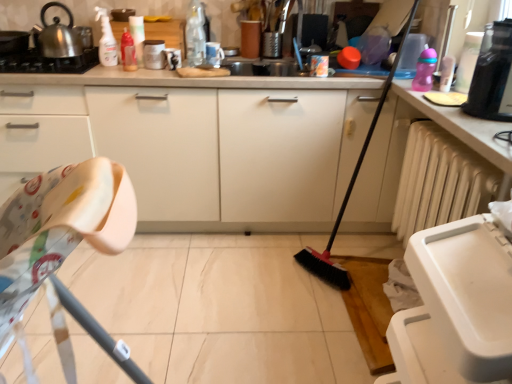
Question: Is white plastic radiator at lower right wider or thinner than white plastic trash can at lower right, placed as the first appliance when sorted from right to left?

Choices:
 (A) thin
 (B) wide

Answer: (A)

Question: From their relative heights in the image, would you say white plastic radiator at lower right is taller or shorter than white plastic trash can at lower right, positioned as the first appliance in bottom-to-top order?

Choices:
 (A) tall
 (B) short

Answer: (B)

Question: Which object is the farthest from the white plastic radiator at lower right?

Choices:
 (A) translucent plastic bottle at upper center, which is counted as the 3th bottle, starting from the right
 (B) white glossy spray bottle at upper center
 (C) metallic stainless steel kettle at upper left, marked as the 1th appliance in a left-to-right arrangement
 (D) white plastic trash can at lower right, the 1th appliance in the front-to-back sequence
 (E) metallic stainless steel kettle at upper left

Answer: (C)

Question: Considering the real-world distances, which object is farthest from the translucent plastic spray bottle at upper center, which appears as the second bottle when viewed from the left?

Choices:
 (A) metallic stainless steel kettle at upper left
 (B) white plastic folding chair at left
 (C) white plastic trash can at lower right, the 1th appliance in the front-to-back sequence
 (D) white plastic radiator at lower right
 (E) white glossy spray bottle at upper center

Answer: (C)